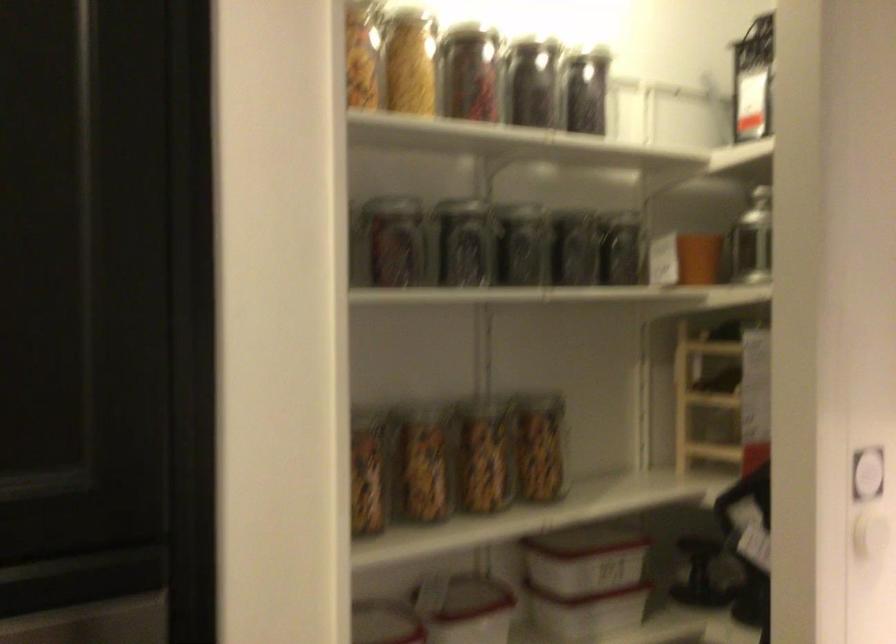
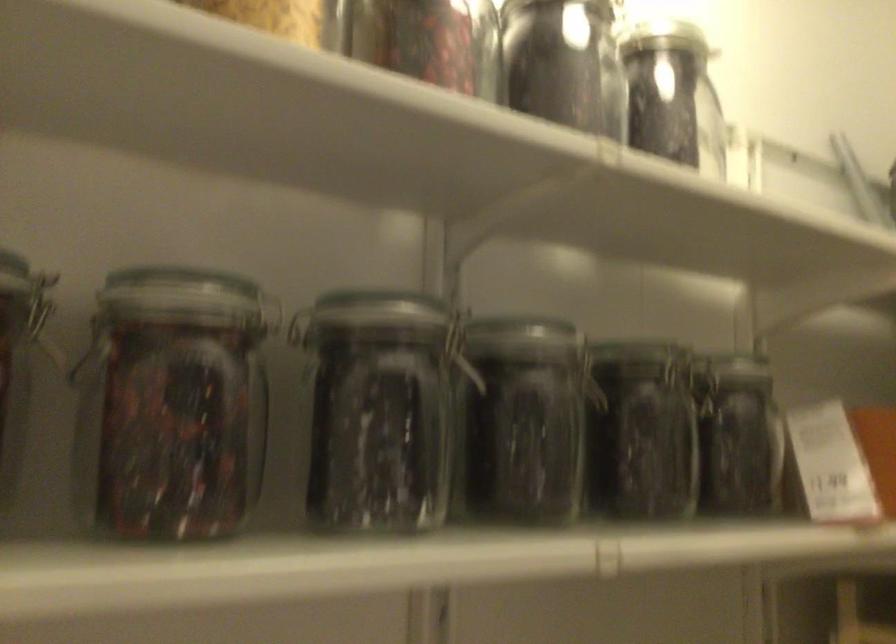
Where in the second image is the point corresponding to (478,89) from the first image?

(426, 41)